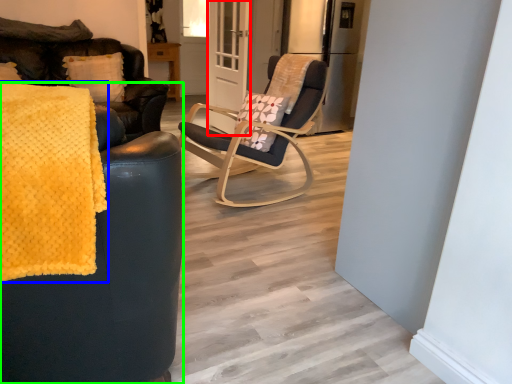
Question: Considering the real-world distances, which object is closest to screen door (highlighted by a red box)? blanket (highlighted by a blue box) or chair (highlighted by a green box).

Choices:
 (A) blanket
 (B) chair

Answer: (B)